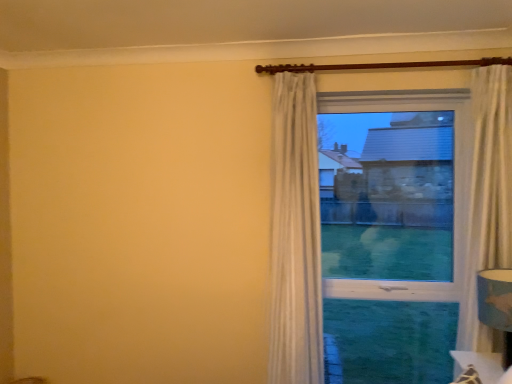
Locate an element on the screen. transparent glass window at center is located at coordinates (387, 195).

Can you confirm if transparent glass window at center is shorter than blue fabric lampshade at lower right?

No, transparent glass window at center is not shorter than blue fabric lampshade at lower right.

Does transparent glass window at center turn towards blue fabric lampshade at lower right?

Yes, transparent glass window at center is turned towards blue fabric lampshade at lower right.

Looking at the image, does transparent glass window at center seem bigger or smaller compared to blue fabric lampshade at lower right?

Considering their sizes, transparent glass window at center takes up more space than blue fabric lampshade at lower right.

Between transparent glass window at center and blue fabric lampshade at lower right, which one has larger width?

blue fabric lampshade at lower right.

Which object is further away from the camera taking this photo, transparent glass window at center or white textured curtain at upper center?

Positioned behind is transparent glass window at center.

From a real-world perspective, is transparent glass window at center positioned above or below white textured curtain at upper center?

transparent glass window at center is above white textured curtain at upper center.

Image resolution: width=512 pixels, height=384 pixels. I want to click on curtain lying in front of the transparent glass window at center, so click(295, 235).

Is white textured curtain at upper center inside or outside of transparent glass window at center?

white textured curtain at upper center is spatially situated outside transparent glass window at center.

Does white textured curtain at upper center touch transparent glass window at center?

No.

Does white textured curtain at upper center lie behind transparent glass window at center?

No, the depth of white textured curtain at upper center is less than that of transparent glass window at center.

Is blue fabric lampshade at lower right situated inside transparent glass window at center or outside?

blue fabric lampshade at lower right is spatially situated outside transparent glass window at center.

Find the location of a particular element. The width and height of the screenshot is (512, 384). table lamp that appears below the transparent glass window at center (from the image's perspective) is located at coordinates pyautogui.click(x=496, y=304).

Does blue fabric lampshade at lower right touch transparent glass window at center?

No, blue fabric lampshade at lower right is not in contact with transparent glass window at center.

In terms of height, does blue fabric lampshade at lower right look taller or shorter compared to transparent glass window at center?

Considering their sizes, blue fabric lampshade at lower right has less height than transparent glass window at center.

This screenshot has height=384, width=512. In the image, there is a white textured curtain at upper center. In order to click on table lamp below it (from a real-world perspective) in this screenshot , I will do `click(496, 304)`.

Are blue fabric lampshade at lower right and white textured curtain at upper center located far from each other?

blue fabric lampshade at lower right is actually quite close to white textured curtain at upper center.

In the scene shown: Can you confirm if blue fabric lampshade at lower right is bigger than white textured curtain at upper center?

No, blue fabric lampshade at lower right is not bigger than white textured curtain at upper center.

Is blue fabric lampshade at lower right turned away from white textured curtain at upper center?

Result: No, white textured curtain at upper center is not at the back of blue fabric lampshade at lower right.

From a real-world perspective, is white textured curtain at upper center beneath blue fabric lampshade at lower right?

No, from a real-world perspective, white textured curtain at upper center is not under blue fabric lampshade at lower right.

Is white textured curtain at upper center to the right of blue fabric lampshade at lower right from the viewer's perspective?

No, white textured curtain at upper center is not to the right of blue fabric lampshade at lower right.

In terms of height, does white textured curtain at upper center look taller or shorter compared to blue fabric lampshade at lower right?

Considering their sizes, white textured curtain at upper center has more height than blue fabric lampshade at lower right.

From the image's perspective, relative to blue fabric lampshade at lower right, is white textured curtain at upper center above or below?

From the image's perspective, white textured curtain at upper center appears above blue fabric lampshade at lower right.

The image size is (512, 384). In the image, there is a transparent glass window at center. Find the location of `table lamp below it (from the image's perspective)`. table lamp below it (from the image's perspective) is located at coordinates (496, 304).

At what (x,y) coordinates should I click in order to perform the action: click on curtain that appears on the left of transparent glass window at center. Please return your answer as a coordinate pair (x, y). The image size is (512, 384). Looking at the image, I should click on (295, 235).

From the image, which object appears to be nearer to transparent glass window at center, blue fabric lampshade at lower right or white textured curtain at upper center?

white textured curtain at upper center is positioned closer to the anchor transparent glass window at center.

When comparing their distances from blue fabric lampshade at lower right, does transparent glass window at center or white textured curtain at upper center seem further?

Among the two, white textured curtain at upper center is located further to blue fabric lampshade at lower right.

When comparing their distances from blue fabric lampshade at lower right, does white textured curtain at upper center or transparent glass window at center seem further?

white textured curtain at upper center.

When comparing their distances from white textured curtain at upper center, does blue fabric lampshade at lower right or transparent glass window at center seem closer?

Among the two, transparent glass window at center is located nearer to white textured curtain at upper center.

Which object lies nearer to the anchor point transparent glass window at center, white textured curtain at upper center or blue fabric lampshade at lower right?

white textured curtain at upper center.

Considering their positions, is transparent glass window at center positioned closer to white textured curtain at upper center than blue fabric lampshade at lower right?

transparent glass window at center lies closer to white textured curtain at upper center than the other object.

Locate an element on the screen. The width and height of the screenshot is (512, 384). window screen located between white textured curtain at upper center and blue fabric lampshade at lower right in the left-right direction is located at coordinates (387, 195).